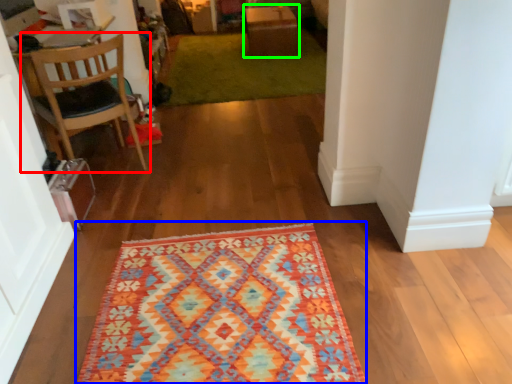
Question: Considering the real-world distances, which object is closest to chair (highlighted by a red box)? mat (highlighted by a blue box) or table (highlighted by a green box).

Choices:
 (A) mat
 (B) table

Answer: (A)